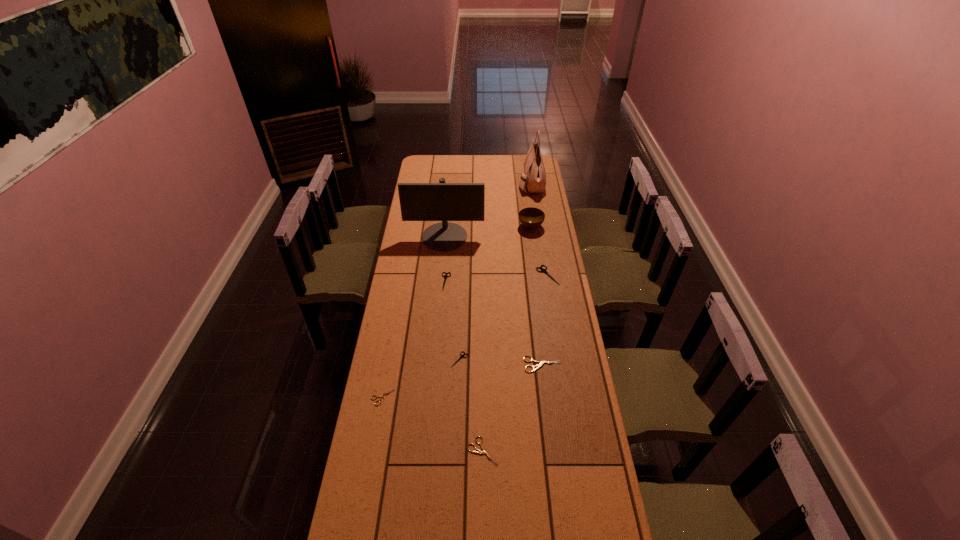
You are a GUI agent. You are given a task and a screenshot of the screen. Output one action in this format:
    pyautogui.click(x=<x>, y=<y>)
    Task: Click on the blank space located 0.130m on the back of the biggest black shears
    
    Given the screenshot: What is the action you would take?
    pyautogui.click(x=543, y=248)

Identify the location of free space located on the right of the leftmost black shears. (525, 281).

Where is `vacant space located on the back of the rightmost beige shears`? The width and height of the screenshot is (960, 540). vacant space located on the back of the rightmost beige shears is located at coordinates (538, 321).

The width and height of the screenshot is (960, 540). Identify the location of free space located 0.190m on the back of the second beige shears from right to left. (482, 388).

What are the coordinates of `free region located 0.280m on the front of the third shears from left to right` in the screenshot? It's located at (456, 436).

Where is `blank space located on the back of the fifth farthest shears`? blank space located on the back of the fifth farthest shears is located at coordinates (389, 364).

Find the location of a particular element. The image size is (960, 540). object present at the far edge is located at coordinates tap(534, 177).

Find the location of a particular element. computer monitor present at the left edge is located at coordinates (441, 201).

Where is `shears that is at the left edge`? shears that is at the left edge is located at coordinates (383, 395).

Locate an element on the screen. The image size is (960, 540). handbag that is at the right edge is located at coordinates (534, 177).